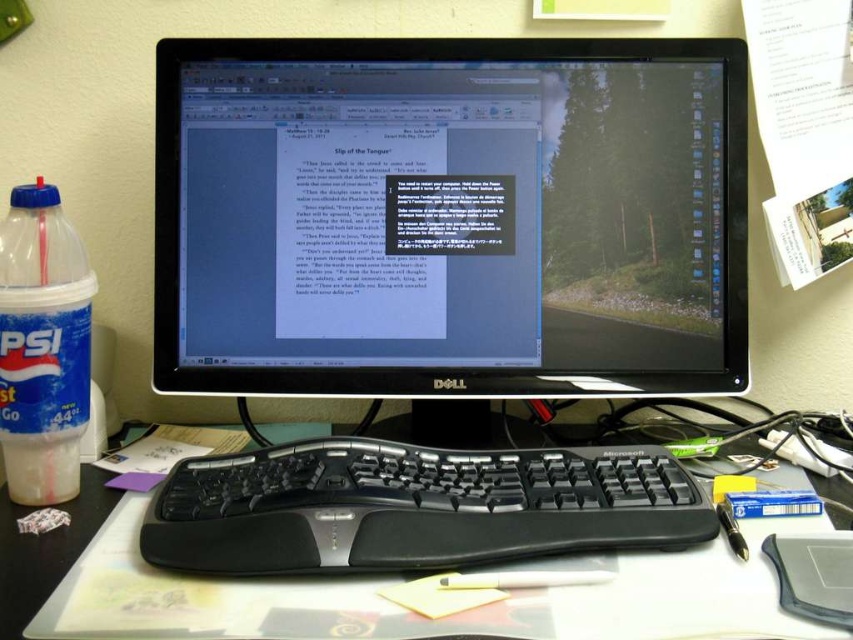
How distant is translucent plastic bottle at left from black plastic mouse at lower right?

A distance of 63.35 centimeters exists between translucent plastic bottle at left and black plastic mouse at lower right.

Does point (10, 371) come closer to viewer compared to point (793, 572)?

No, it is behind (793, 572).

Identify the location of translucent plastic bottle at left. (42, 346).

Which is in front, point (293, 356) or point (842, 536)?

Point (842, 536)

Measure the distance between black glossy monitor at center and camera.

black glossy monitor at center is 31.73 inches away from camera.

This screenshot has width=853, height=640. I want to click on black glossy monitor at center, so click(450, 216).

Identify the location of black glossy monitor at center. The image size is (853, 640). (450, 216).

Who is more distant from viewer, (x=9, y=262) or (x=67, y=556)?

Point (x=9, y=262)

Who is taller, translucent plastic bottle at left or white plastic keyboard at center?

Standing taller between the two is translucent plastic bottle at left.

Locate an element on the screen. Image resolution: width=853 pixels, height=640 pixels. translucent plastic bottle at left is located at coordinates (42, 346).